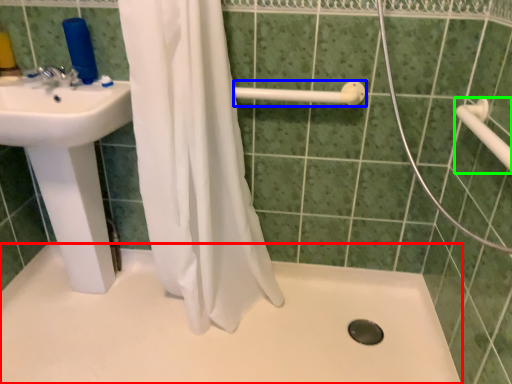
Question: Considering the real-world distances, which object is closest to bath (highlighted by a red box)? shower (highlighted by a blue box) or towel bar (highlighted by a green box).

Choices:
 (A) shower
 (B) towel bar

Answer: (A)